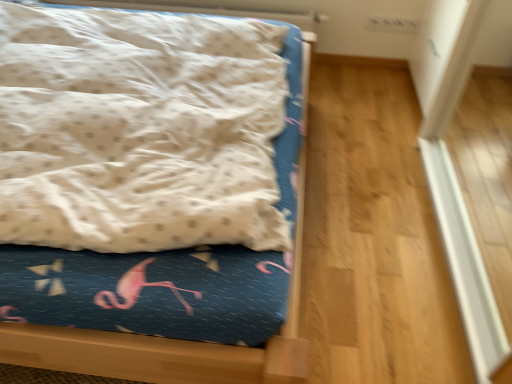
Question: Should I look upward or downward to see blue fabric bed at left?

Choices:
 (A) up
 (B) down

Answer: (A)